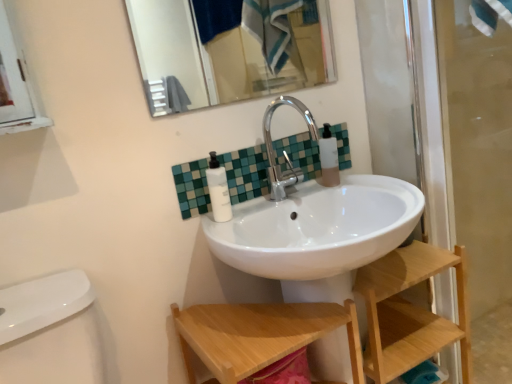
Find the location of a particular element. The image size is (512, 384). vacant space positioned to the left of silver metallic faucet at center is located at coordinates (257, 210).